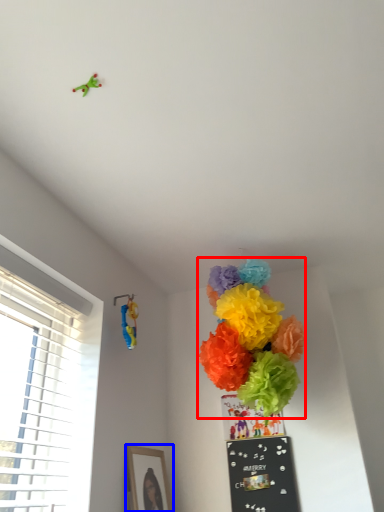
Question: Which point is closer to the camera, flower (highlighted by a red box) or picture frame (highlighted by a blue box)?

Choices:
 (A) flower
 (B) picture frame

Answer: (A)